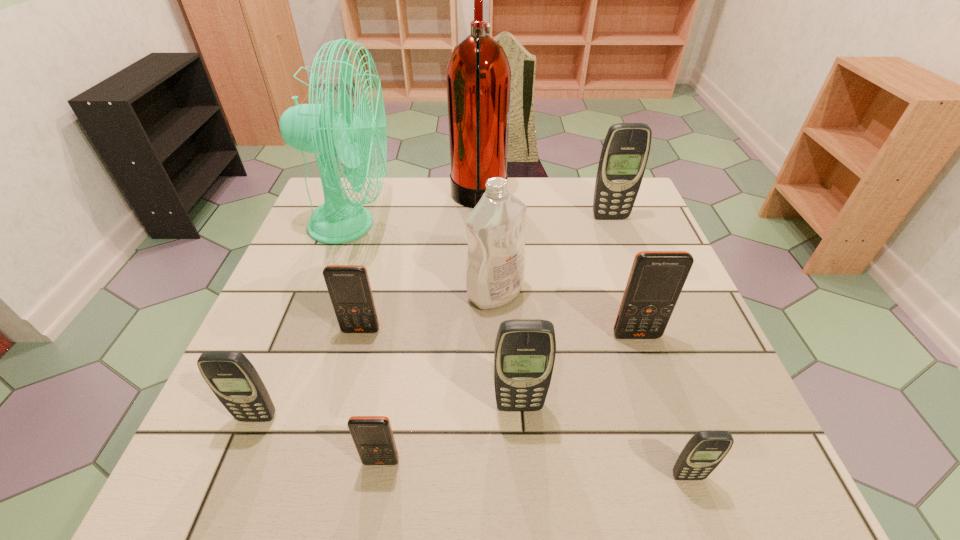
Locate which gray cellular telephone ranks in proximity to the tallest cellular telephone. Please provide its 2D coordinates. Your answer should be formatted as a tuple, i.e. [(x, y)], where the tuple contains the x and y coordinates of a point satisfying the conditions above.

[(525, 349)]

Locate an element on the screen. orange cellular telephone that is the closest to the red fire extinguisher is located at coordinates (349, 288).

Select which orange cellular telephone is the second closest to the sixth farthest cellular telephone. Please provide its 2D coordinates. Your answer should be formatted as a tuple, i.e. [(x, y)], where the tuple contains the x and y coordinates of a point satisfying the conditions above.

[(656, 279)]

At what (x,y) coordinates should I click in order to perform the action: click on vacant area in the image that satisfies the following two spatial constraints: 1. on the screen of the farthest cellular telephone; 2. in front of the blue fan to blow air. Please return your answer as a coordinate pair (x, y). The width and height of the screenshot is (960, 540). Looking at the image, I should click on (612, 225).

Image resolution: width=960 pixels, height=540 pixels. In order to click on free spot that satisfies the following two spatial constraints: 1. on the front-facing side of the fire extinguisher; 2. on the screen of the smallest orange cellular telephone in this screenshot , I will do `click(478, 462)`.